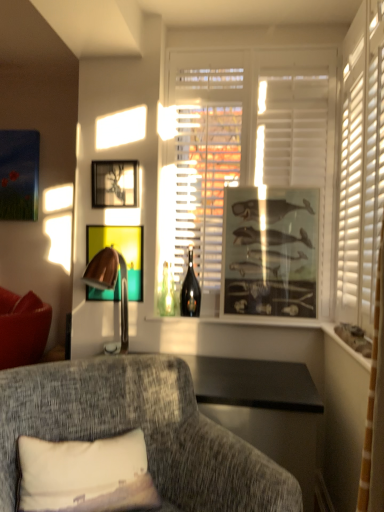
Question: Does white matte window at center have a lesser height compared to metallic gold picture frame at center, acting as the 2th picture frame starting from the right?

Choices:
 (A) no
 (B) yes

Answer: (A)

Question: Does white matte window at center have a greater width compared to metallic gold picture frame at center, acting as the 2th picture frame starting from the right?

Choices:
 (A) no
 (B) yes

Answer: (B)

Question: Can you confirm if white matte window at center is smaller than metallic gold picture frame at center, acting as the 2th picture frame starting from the right?

Choices:
 (A) no
 (B) yes

Answer: (A)

Question: Does white matte window at center have a greater height compared to metallic gold picture frame at center, positioned as the second picture frame in left-to-right order?

Choices:
 (A) no
 (B) yes

Answer: (B)

Question: Could you tell me if white matte window at center is facing metallic gold picture frame at center, positioned as the second picture frame in left-to-right order?

Choices:
 (A) no
 (B) yes

Answer: (A)

Question: Is white matte window at center closer to the viewer compared to metallic gold picture frame at center, acting as the 2th picture frame starting from the right?

Choices:
 (A) yes
 (B) no

Answer: (A)

Question: Considering the relative sizes of metallic silver picture frame at upper center, acting as the first picture frame starting from the left, and matte glass window sill at right, placed as the second window sill when sorted from back to front, in the image provided, is metallic silver picture frame at upper center, acting as the first picture frame starting from the left, smaller than matte glass window sill at right, placed as the second window sill when sorted from back to front,?

Choices:
 (A) no
 (B) yes

Answer: (A)

Question: Can you confirm if metallic silver picture frame at upper center, marked as the 3th picture frame in a right-to-left arrangement, is thinner than matte glass window sill at right, the first window sill positioned from the front?

Choices:
 (A) yes
 (B) no

Answer: (A)

Question: From a real-world perspective, does metallic silver picture frame at upper center, marked as the 3th picture frame in a right-to-left arrangement, stand above matte glass window sill at right, placed as the second window sill when sorted from back to front?

Choices:
 (A) yes
 (B) no

Answer: (A)

Question: Is metallic silver picture frame at upper center, marked as the 3th picture frame in a right-to-left arrangement, oriented away from matte glass window sill at right, which is the second window sill from left to right?

Choices:
 (A) yes
 (B) no

Answer: (B)

Question: Does metallic silver picture frame at upper center, marked as the 3th picture frame in a right-to-left arrangement, have a greater width compared to matte glass window sill at right, which is the second window sill from left to right?

Choices:
 (A) no
 (B) yes

Answer: (A)

Question: Is metallic silver picture frame at upper center, marked as the 3th picture frame in a right-to-left arrangement, taller than matte glass window sill at right, marked as the 1th window sill in a right-to-left arrangement?

Choices:
 (A) yes
 (B) no

Answer: (A)

Question: From a real-world perspective, does copper metallic table lamp at left stand above shiny dark glass wine bottle at center?

Choices:
 (A) no
 (B) yes

Answer: (A)